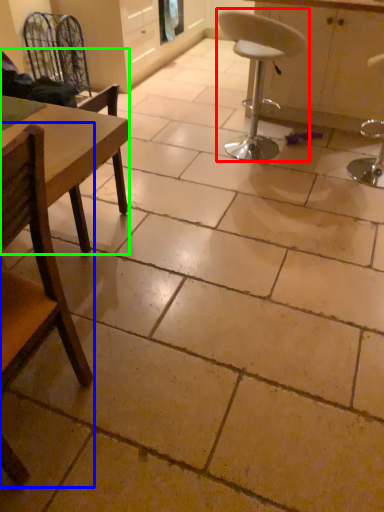
Question: Which is nearer to the chair (highlighted by a red box)? chair (highlighted by a blue box) or chair (highlighted by a green box).

Choices:
 (A) chair
 (B) chair

Answer: (B)